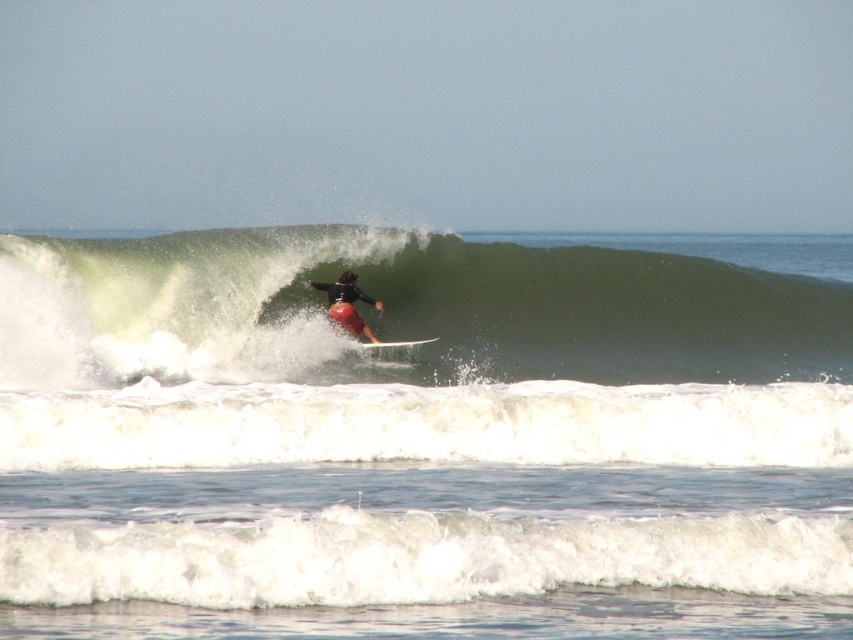
Can you confirm if matte black wetsuit at center is bigger than white glossy surfboard at center?

Indeed, matte black wetsuit at center has a larger size compared to white glossy surfboard at center.

Where is `matte black wetsuit at center`? This screenshot has height=640, width=853. matte black wetsuit at center is located at coordinates (347, 304).

What do you see at coordinates (347, 304) in the screenshot?
I see `matte black wetsuit at center` at bounding box center [347, 304].

The image size is (853, 640). In order to click on matte black wetsuit at center in this screenshot , I will do pos(347,304).

Which is above, green rubber wave at center or matte black wetsuit at center?

green rubber wave at center is above.

From the picture: Is green rubber wave at center smaller than matte black wetsuit at center?

Incorrect, green rubber wave at center is not smaller in size than matte black wetsuit at center.

Is point (242, 316) farther from camera compared to point (367, 330)?

No.

Locate an element on the screen. This screenshot has width=853, height=640. green rubber wave at center is located at coordinates (514, 296).

Who is taller, green rubber wave at center or white glossy surfboard at center?

Standing taller between the two is green rubber wave at center.

From the picture: Which is above, green rubber wave at center or white glossy surfboard at center?

Positioned higher is green rubber wave at center.

This screenshot has width=853, height=640. Find the location of `green rubber wave at center`. green rubber wave at center is located at coordinates (514, 296).

Find the location of a particular element. The height and width of the screenshot is (640, 853). green rubber wave at center is located at coordinates (514, 296).